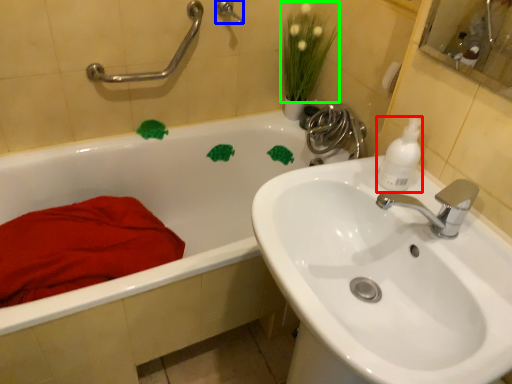
Question: Which object is positioned closest to cleaning product (highlighted by a red box)? Select from shower (highlighted by a blue box) and plant (highlighted by a green box).

Choices:
 (A) shower
 (B) plant

Answer: (B)